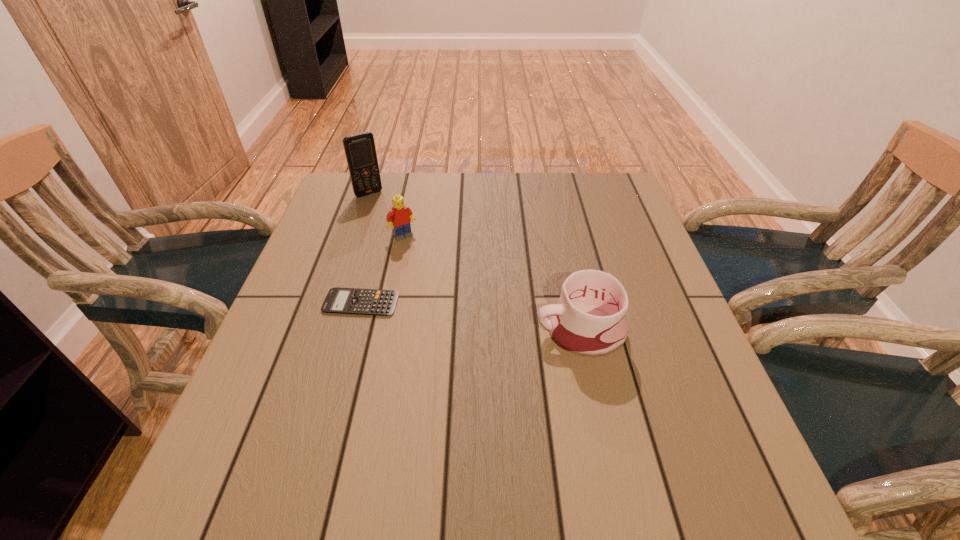
Where is `vacant area in the image that satisfies the following two spatial constraints: 1. on the back side of the shortest object; 2. on the left side of the Lego`? The height and width of the screenshot is (540, 960). vacant area in the image that satisfies the following two spatial constraints: 1. on the back side of the shortest object; 2. on the left side of the Lego is located at coordinates (379, 236).

Image resolution: width=960 pixels, height=540 pixels. Find the location of `free space that satisfies the following two spatial constraints: 1. on the front side of the shortest object; 2. on the left side of the tallest object`. free space that satisfies the following two spatial constraints: 1. on the front side of the shortest object; 2. on the left side of the tallest object is located at coordinates (332, 303).

Where is `free space that satisfies the following two spatial constraints: 1. on the front side of the cellular telephone; 2. on the side with the handle of the mug`? The height and width of the screenshot is (540, 960). free space that satisfies the following two spatial constraints: 1. on the front side of the cellular telephone; 2. on the side with the handle of the mug is located at coordinates (323, 331).

At what (x,y) coordinates should I click in order to perform the action: click on free region that satisfies the following two spatial constraints: 1. on the front side of the rightmost object; 2. on the side with the handle of the second farthest object. Please return your answer as a coordinate pair (x, y). The height and width of the screenshot is (540, 960). Looking at the image, I should click on (383, 331).